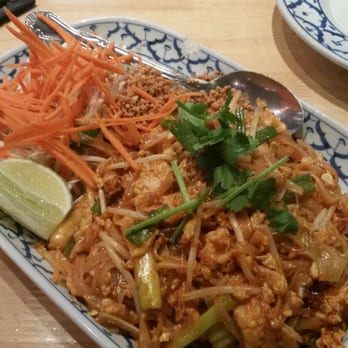
Image resolution: width=348 pixels, height=348 pixels. What are the coordinates of `chip in plate border` in the screenshot? It's located at (188, 45).